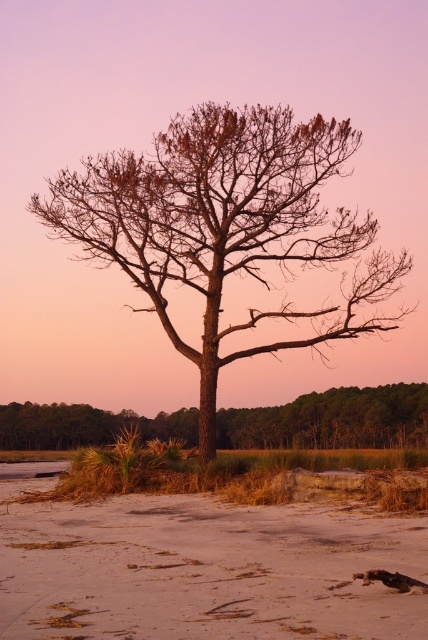
You are a hiker who wants to take a photo of the bare wood tree at center and the brown textured tree at center from a distance. Which tree will appear taller in the photo?

The bare wood tree at center appears taller in the photo because it has a greater height compared to the brown textured tree at center.

You are standing on the beach and see the sandy beige at lower center and the bare wood tree at center. Which object is located to the right of the other?

The sandy beige at lower center is to the right of the bare wood tree at center.

You are an artist trying to paint this scene. You have a small canvas that can only fit objects of a certain size. If you want to include both the sandy beige at lower center and the brown textured tree at center, which one should you prioritize to ensure it fits properly?

Answer: The sandy beige at lower center has a smaller size compared to the brown textured tree at center, so you should prioritize including the brown textured tree at center since it is larger and might not fit if the canvas is limited in size.